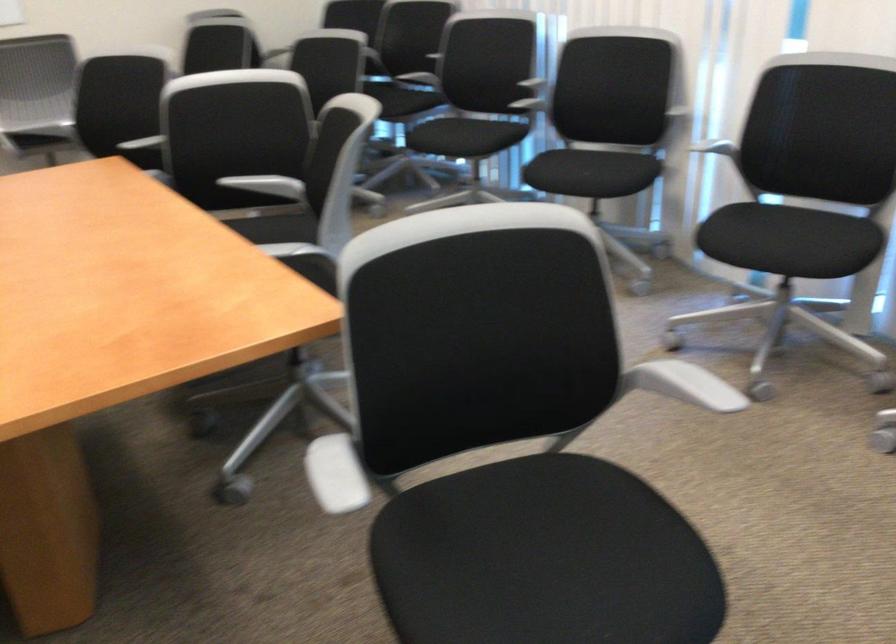
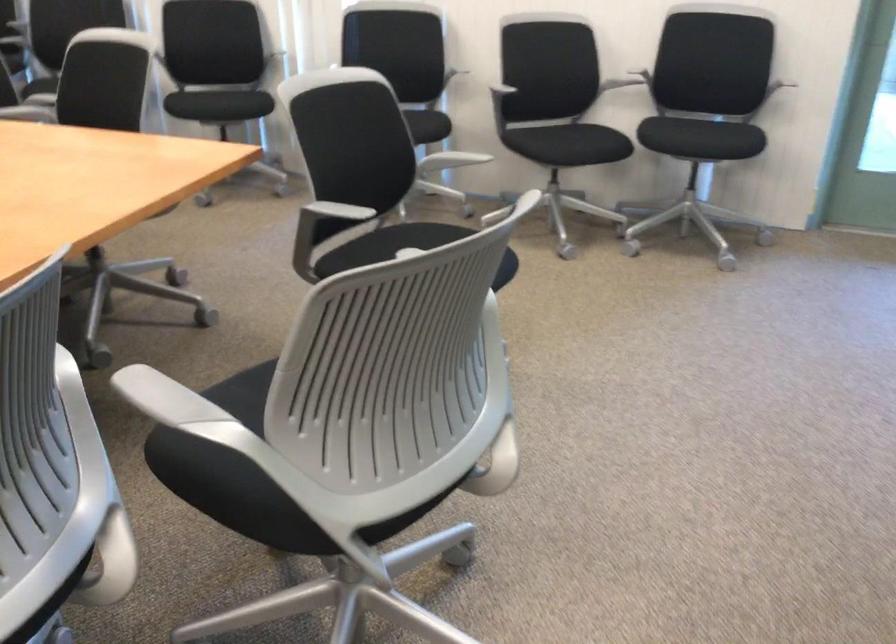
In the second image, find the point that corresponds to pixel 604 183 in the first image.

(238, 102)